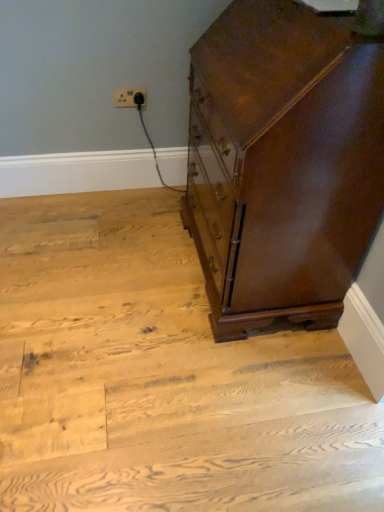
Question: From a real-world perspective, does shiny brown wood chest of drawers at right stand above white plastic outlet at upper center?

Choices:
 (A) no
 (B) yes

Answer: (B)

Question: Does shiny brown wood chest of drawers at right lie in front of white plastic outlet at upper center?

Choices:
 (A) no
 (B) yes

Answer: (B)

Question: From the image's perspective, is shiny brown wood chest of drawers at right located above white plastic outlet at upper center?

Choices:
 (A) no
 (B) yes

Answer: (A)

Question: Is white plastic outlet at upper center a part of shiny brown wood chest of drawers at right?

Choices:
 (A) no
 (B) yes

Answer: (A)

Question: Is shiny brown wood chest of drawers at right wider than white plastic outlet at upper center?

Choices:
 (A) no
 (B) yes

Answer: (B)

Question: Does point tap(286, 106) appear closer or farther from the camera than point tap(297, 435)?

Choices:
 (A) closer
 (B) farther

Answer: (A)

Question: Visually, is shiny brown wood chest of drawers at right positioned to the left or to the right of wooden floor at center?

Choices:
 (A) right
 (B) left

Answer: (A)

Question: From a real-world perspective, is shiny brown wood chest of drawers at right physically located above or below wooden floor at center?

Choices:
 (A) below
 (B) above

Answer: (B)

Question: Is shiny brown wood chest of drawers at right inside the boundaries of wooden floor at center, or outside?

Choices:
 (A) inside
 (B) outside

Answer: (B)

Question: Is wooden floor at center situated inside white plastic outlet at upper center or outside?

Choices:
 (A) outside
 (B) inside

Answer: (A)

Question: From a real-world perspective, is wooden floor at center positioned above or below white plastic outlet at upper center?

Choices:
 (A) below
 (B) above

Answer: (A)

Question: From the image's perspective, is wooden floor at center above or below white plastic outlet at upper center?

Choices:
 (A) below
 (B) above

Answer: (A)

Question: Based on their positions, is wooden floor at center located to the left or right of white plastic outlet at upper center?

Choices:
 (A) right
 (B) left

Answer: (A)

Question: From the image's perspective, is shiny brown wood chest of drawers at right positioned above or below white plastic outlet at upper center?

Choices:
 (A) below
 (B) above

Answer: (A)

Question: In terms of height, does shiny brown wood chest of drawers at right look taller or shorter compared to white plastic outlet at upper center?

Choices:
 (A) short
 (B) tall

Answer: (B)